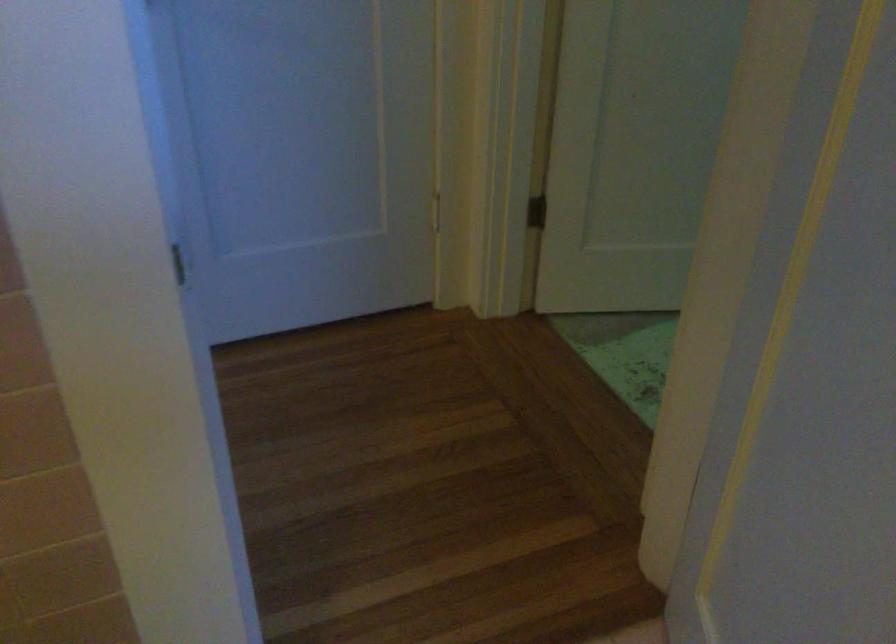
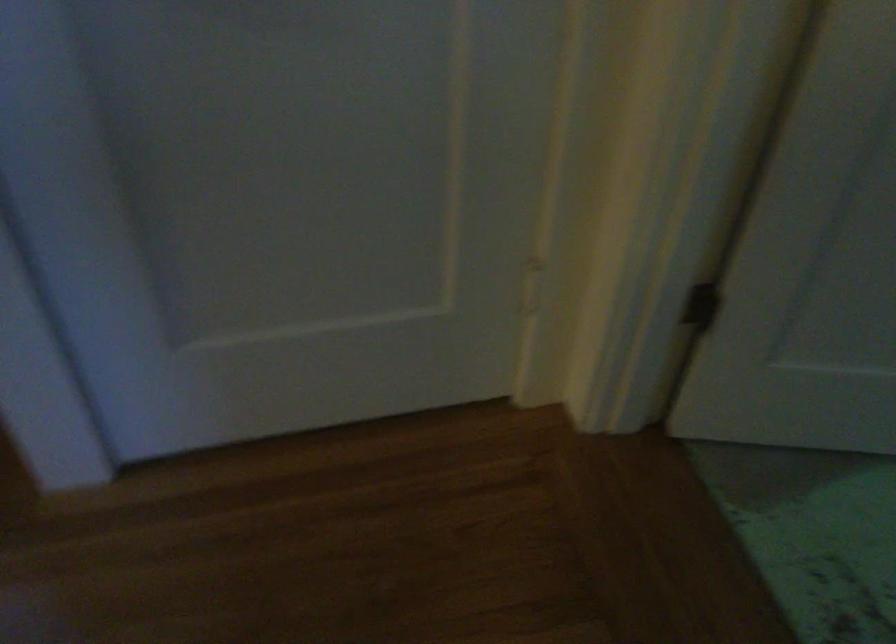
Question: How did the camera likely rotate?

Choices:
 (A) Left
 (B) Right
 (C) Up
 (D) Down

Answer: (D)